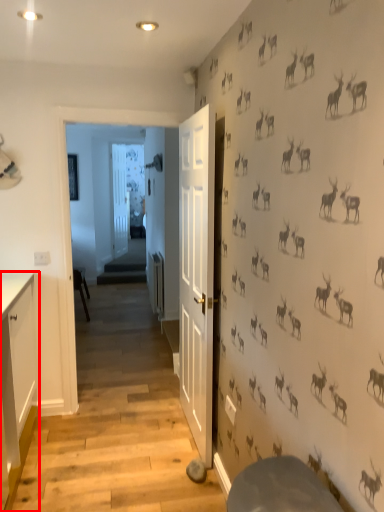
Question: From the image, what is the correct spatial relationship of cabinetry (annotated by the red box) in relation to door?

Choices:
 (A) left
 (B) right

Answer: (B)